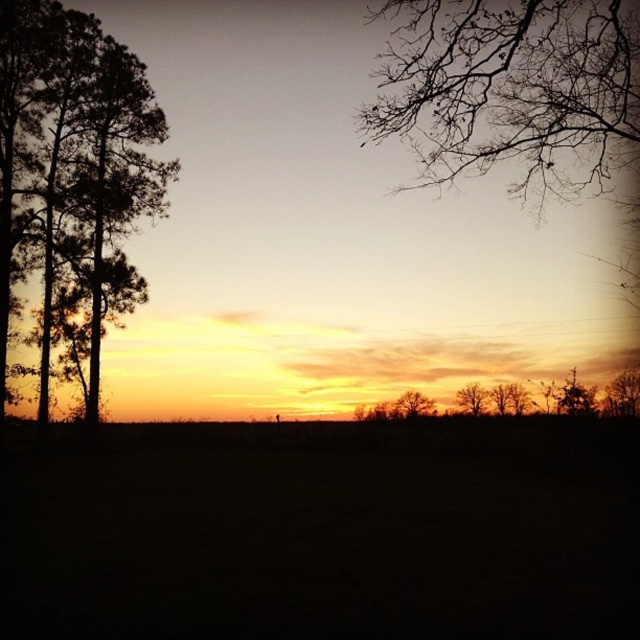
Between point (321, 467) and point (380, 118), which one is positioned behind?

Point (321, 467)

Is point (605, 522) more distant than point (634, 228)?

That is False.

At what (x,y) coordinates should I click in order to perform the action: click on dark grass at center. Please return your answer as a coordinate pair (x, y). Looking at the image, I should click on (323, 531).

Is dark grass at center wider than dark green foliage at left?

Yes.

Where is `dark grass at center`? This screenshot has width=640, height=640. dark grass at center is located at coordinates (323, 531).

Describe the element at coordinates (516, 92) in the screenshot. I see `bare branches at upper right` at that location.

Consider the image. Is bare branches at upper right smaller than dark green foliage at left?

Actually, bare branches at upper right might be larger than dark green foliage at left.

Who is more forward, (x=458, y=65) or (x=13, y=161)?

Positioned in front is point (x=458, y=65).

The height and width of the screenshot is (640, 640). Identify the location of bare branches at upper right. (516, 92).